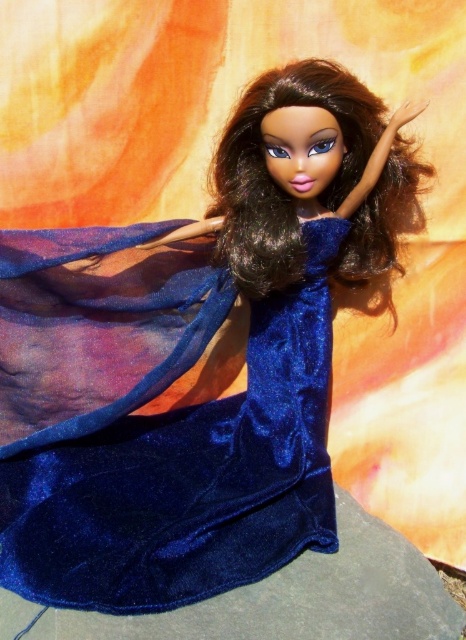
Does shiny blue fabric dress at center have a greater width compared to shiny dark brown hair at center?

Indeed, shiny blue fabric dress at center has a greater width compared to shiny dark brown hair at center.

Is shiny blue fabric dress at center shorter than shiny dark brown hair at center?

Incorrect, shiny blue fabric dress at center's height does not fall short of shiny dark brown hair at center's.

Who is more forward, (109, 406) or (347, 240)?

Positioned in front is point (347, 240).

This screenshot has height=640, width=466. In order to click on shiny blue fabric dress at center in this screenshot , I will do `click(157, 429)`.

Does shiny blue fabric dress at center lie behind velvet blue fabric at center?

Yes, shiny blue fabric dress at center is further from the viewer.

Which is more to the left, shiny blue fabric dress at center or velvet blue fabric at center?

shiny blue fabric dress at center

Which is behind, point (68, 456) or point (349, 604)?

Positioned behind is point (68, 456).

In order to click on shiny blue fabric dress at center in this screenshot , I will do `click(157, 429)`.

Who is positioned more to the right, velvet blue fabric at center or shiny dark brown hair at center?

shiny dark brown hair at center

Can you confirm if velvet blue fabric at center is positioned above shiny dark brown hair at center?

No.

Who is more distant from viewer, (429, 625) or (328, 76)?

Positioned behind is point (328, 76).

Where is `velvet blue fabric at center`? This screenshot has height=640, width=466. velvet blue fabric at center is located at coordinates (301, 596).